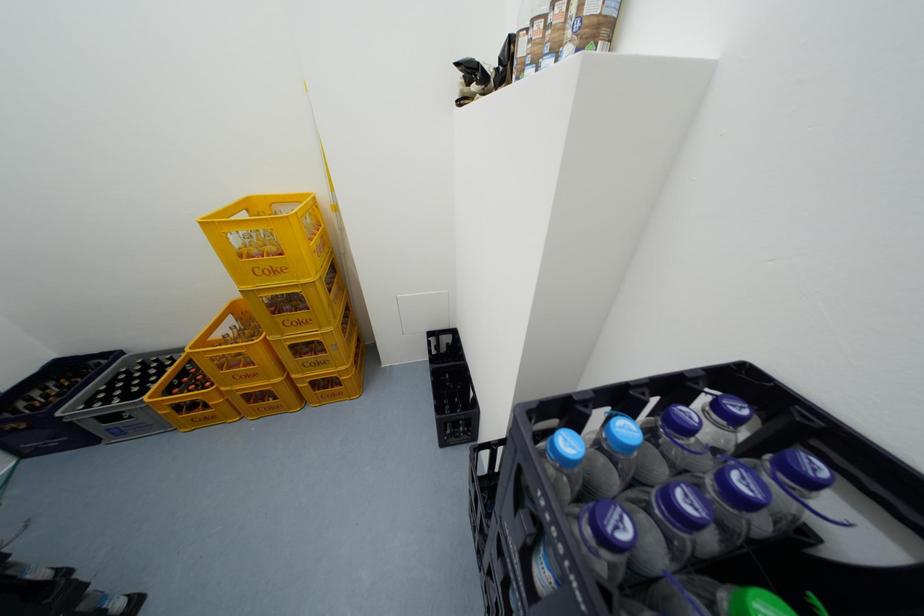
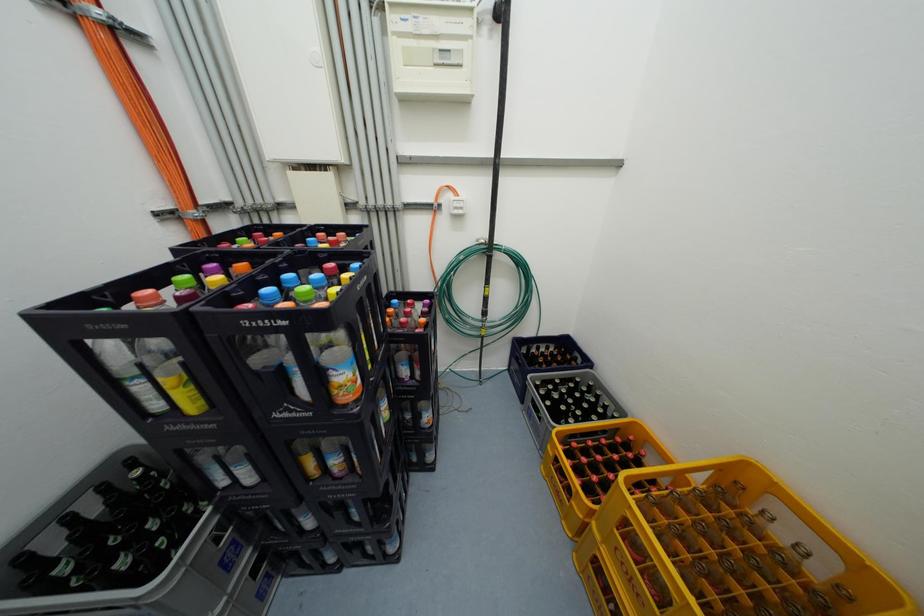
The first image is from the beginning of the video and the second image is from the end. How did the camera likely rotate when shooting the video?

The rotation direction of the camera is left-down.